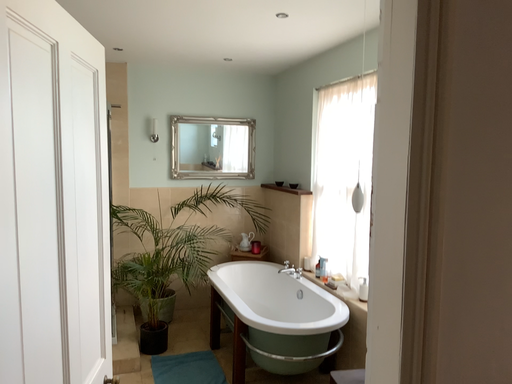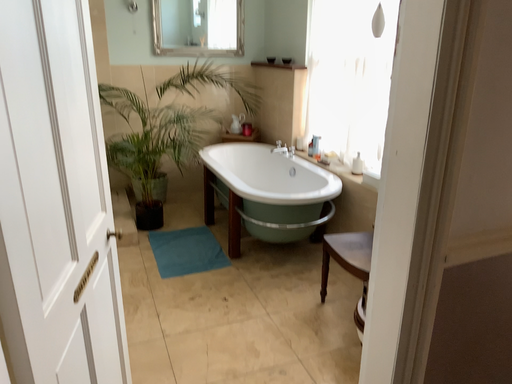
Question: How did the camera likely rotate when shooting the video?

Choices:
 (A) rotated upward
 (B) rotated downward

Answer: (B)